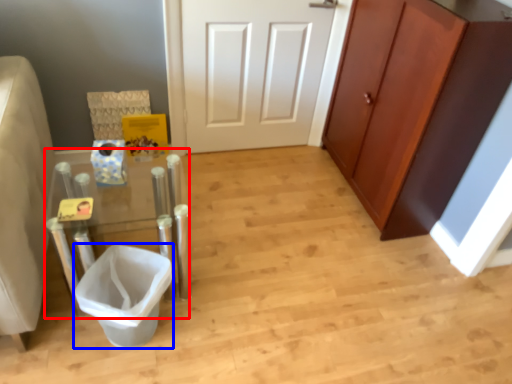
Question: Among these objects, which one is farthest to the camera, vanity (highlighted by a red box) or toilet bowl (highlighted by a blue box)?

Choices:
 (A) vanity
 (B) toilet bowl

Answer: (B)